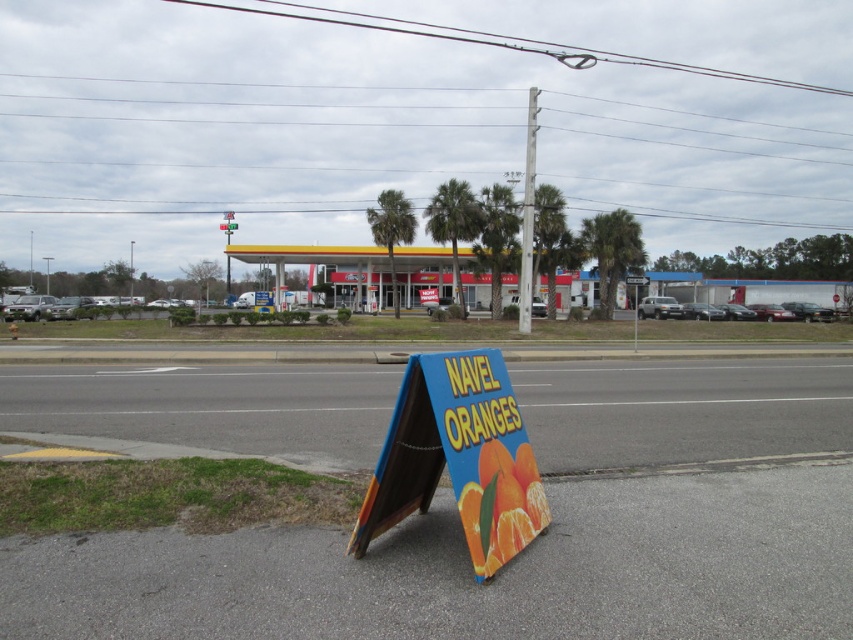
The height and width of the screenshot is (640, 853). What do you see at coordinates (329, 268) in the screenshot?
I see `white glossy gas station at center` at bounding box center [329, 268].

Is white glossy gas station at center further to the viewer compared to metallic silver street sign at center?

That is False.

Between point (436, 275) and point (233, 227), which one is positioned in front?

Point (436, 275) is in front.

This screenshot has height=640, width=853. Find the location of `white glossy gas station at center`. white glossy gas station at center is located at coordinates [329, 268].

Does white glossy gas station at center have a smaller size compared to wooden pole at center?

Indeed, white glossy gas station at center has a smaller size compared to wooden pole at center.

You are a GUI agent. You are given a task and a screenshot of the screen. Output one action in this format:
    pyautogui.click(x=<x>, y=<y>)
    Task: Click on the white glossy gas station at center
    
    Given the screenshot: What is the action you would take?
    pyautogui.click(x=329, y=268)

Find the location of a particular element. Image resolution: width=853 pixels, height=640 pixels. white glossy gas station at center is located at coordinates (329, 268).

Is wooden pole at center in front of metallic silver street sign at center?

Yes, it is.

What do you see at coordinates (527, 218) in the screenshot?
I see `wooden pole at center` at bounding box center [527, 218].

In order to click on wooden pole at center in this screenshot , I will do `click(527, 218)`.